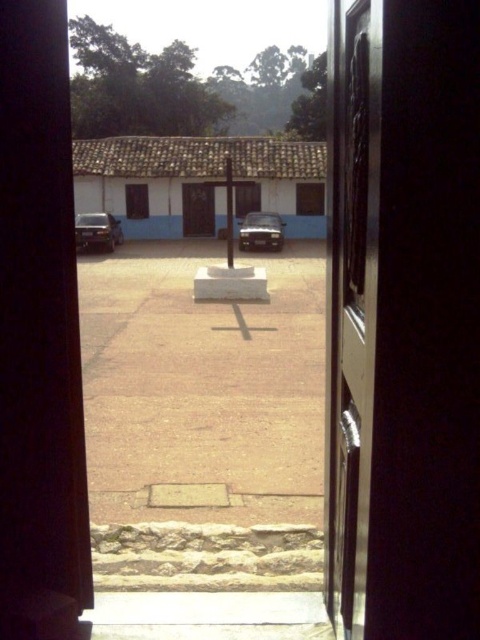
Question: Estimate the real-world distances between objects in this image. Which object is farther from the polished wood door at center?

Choices:
 (A) satin silver car at center
 (B) shiny black car at left

Answer: (A)

Question: Does polished wood door at center appear under shiny black car at left?

Choices:
 (A) yes
 (B) no

Answer: (A)

Question: Does polished wood door at center have a smaller size compared to satin silver car at center?

Choices:
 (A) no
 (B) yes

Answer: (A)

Question: Which of these objects is positioned farthest from the polished wood door at center?

Choices:
 (A) shiny black car at left
 (B) satin silver car at center

Answer: (B)

Question: Considering the real-world distances, which object is closest to the satin silver car at center?

Choices:
 (A) shiny black car at left
 (B) polished wood door at center

Answer: (A)

Question: Does polished wood door at center appear over satin silver car at center?

Choices:
 (A) yes
 (B) no

Answer: (B)